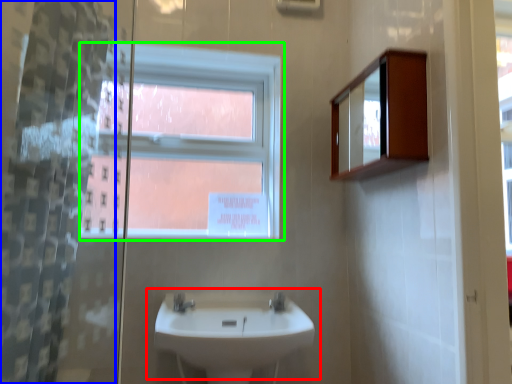
Question: Considering the real-world distances, which object is closest to sink (highlighted by a red box)? shower curtain (highlighted by a blue box) or window (highlighted by a green box).

Choices:
 (A) shower curtain
 (B) window

Answer: (B)